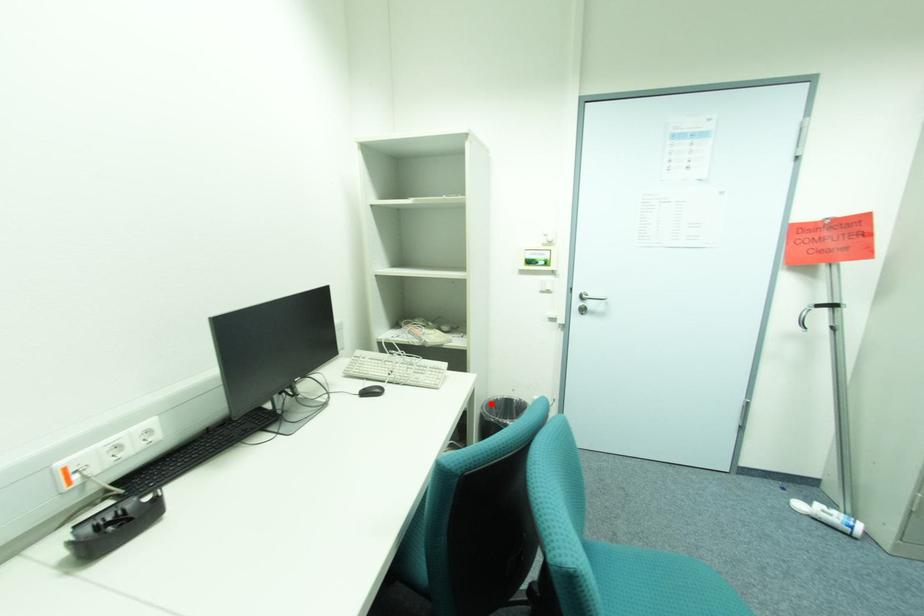
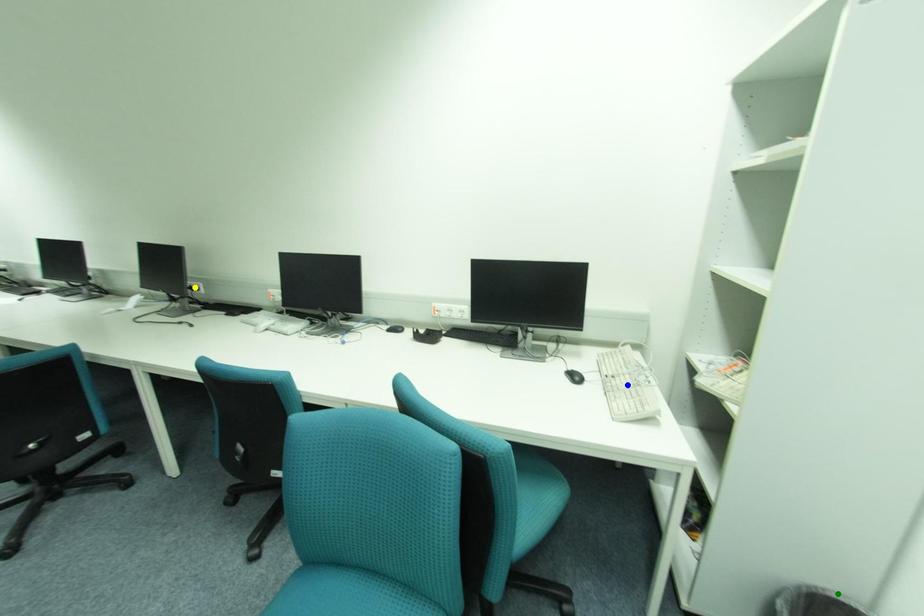
Question: I am providing you with two images of the same scene from different viewpoints. A red point is marked on the first image. You are given multiple points on the second image. Which mark in image 2 goes with the point in image 1?

Choices:
 (A) blue point
 (B) green point
 (C) yellow point

Answer: (B)